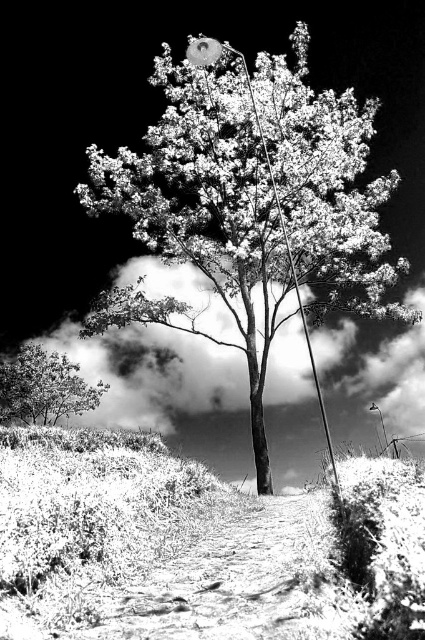
You are a photographer trying to capture both the smooth bark tree at center and the smooth green tree at lower left in a single frame. Based on their sizes, which tree should you focus on to ensure both are visible without cropping?

The smooth bark tree at center is larger than the smooth green tree at lower left, so you should focus on the smooth bark tree at center to ensure both are visible without cropping.

You are a photographer analyzing the composition of this black and white photo. You notice two trees in the scene. Which tree is positioned higher in the frame, the smooth bark tree at center or the smooth green tree at lower left?

The smooth bark tree at center is positioned higher in the frame than the smooth green tree at lower left.

You are a photographer who wants to capture the smooth bark tree at center in a black and white infrared photo. You need to ensure the tree is centered in the frame. Based on the coordinates given, is the tree already centered in the image?

The smooth bark tree at center is located at coordinates point (251, 204), which means it is not perfectly centered in the image. To center it, the photographer should adjust the camera position so the tree aligns with the center point of the frame.